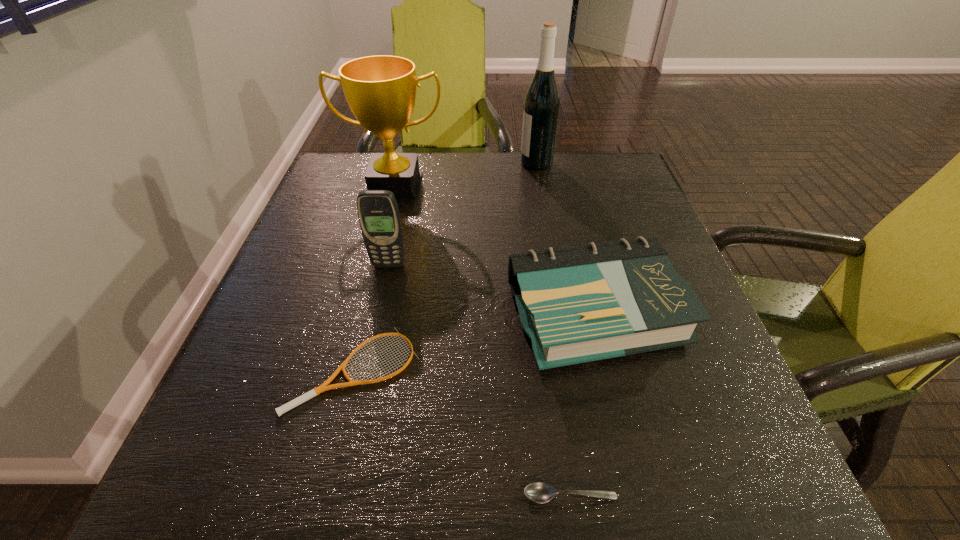
Identify the location of object positioned at the far left corner. This screenshot has height=540, width=960. (380, 90).

Locate an element on the screen. vacant space at the far edge of the desktop is located at coordinates (494, 190).

I want to click on vacant space at the near edge of the desktop, so click(x=523, y=472).

Locate an element on the screen. The image size is (960, 540). free space at the left edge is located at coordinates (321, 321).

In the image, there is a desktop. Where is `free region at the right edge`? free region at the right edge is located at coordinates (639, 390).

Find the location of a particular element. vacant area at the near left corner is located at coordinates (289, 512).

Locate an element on the screen. Image resolution: width=960 pixels, height=540 pixels. vacant space at the far right corner of the desktop is located at coordinates (611, 173).

Where is `free region at the near right corner of the desktop`? Image resolution: width=960 pixels, height=540 pixels. free region at the near right corner of the desktop is located at coordinates (733, 457).

The image size is (960, 540). Find the location of `free space between the award and the wine bottle`. free space between the award and the wine bottle is located at coordinates (466, 174).

Identify the location of free space that is in between the third tallest object and the tallest object. (463, 214).